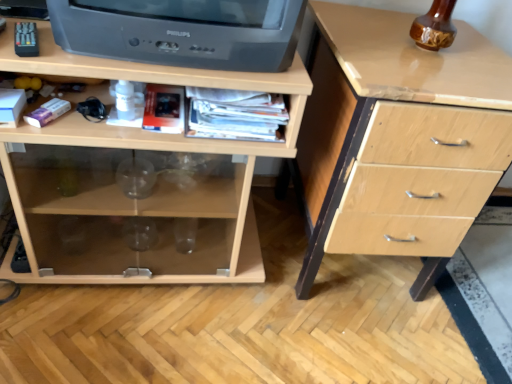
Question: Considering their positions, is black plastic television at upper left located in front of or behind light wood chest of drawers at center, arranged as the 2th chest of drawers when viewed from the right?

Choices:
 (A) behind
 (B) front

Answer: (B)

Question: From the image's perspective, is black plastic television at upper left above or below light wood chest of drawers at center, arranged as the 2th chest of drawers when viewed from the right?

Choices:
 (A) above
 (B) below

Answer: (A)

Question: Which object is the closest to the black plastic television at upper left?

Choices:
 (A) light wood chest of drawers at right, which is the 1th chest of drawers from right to left
 (B) light wood chest of drawers at center, arranged as the first chest of drawers when viewed from the left

Answer: (B)

Question: Which is nearer to the light wood chest of drawers at center, arranged as the first chest of drawers when viewed from the left?

Choices:
 (A) black plastic television at upper left
 (B) light wood chest of drawers at right, the 2th chest of drawers viewed from the left

Answer: (A)